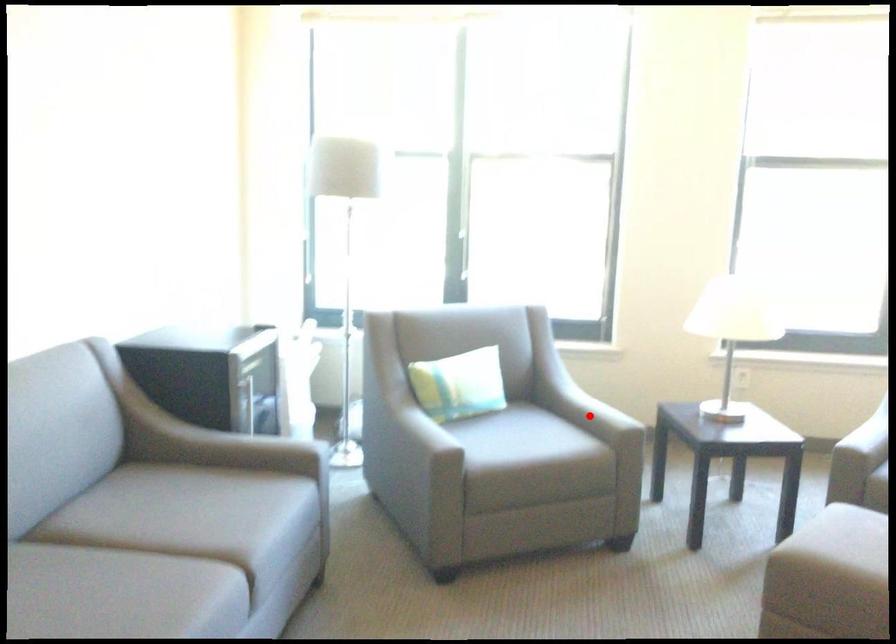
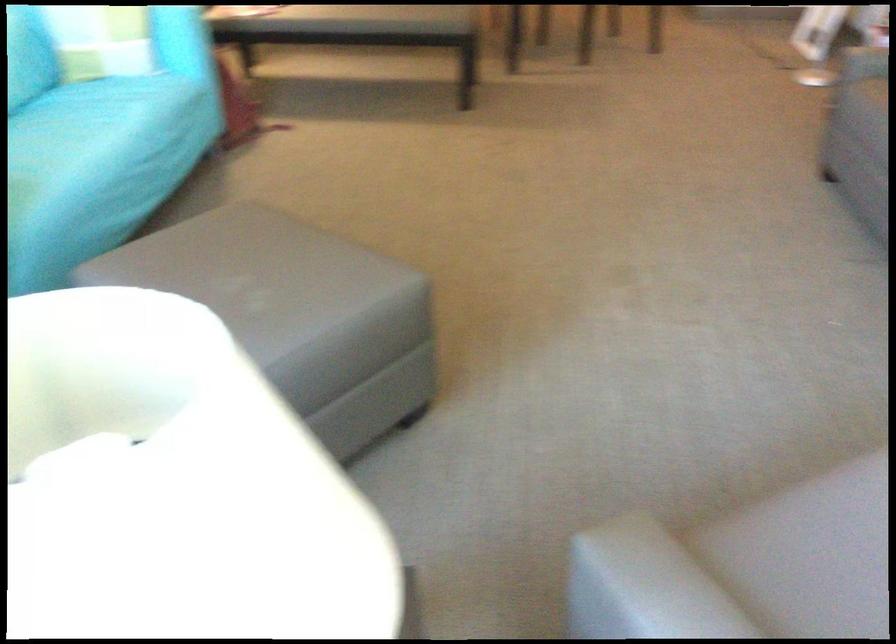
Where in the second image is the point corresponding to the highlighted location from the first image?

(665, 583)